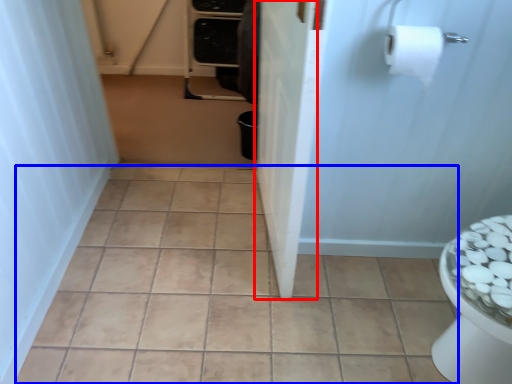
Question: Among these objects, which one is nearest to the camera, screen door (highlighted by a red box) or ceramic tile (highlighted by a blue box)?

Choices:
 (A) screen door
 (B) ceramic tile

Answer: (A)